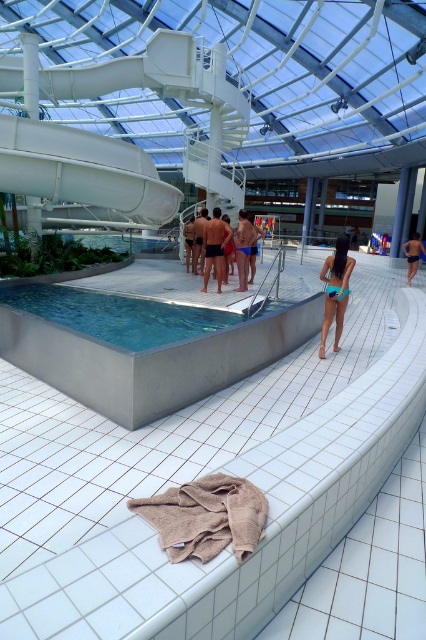
You are a lifeguard observing the pool area. You notice two items at the center of the pool area labeled as dark blue swimsuit at center and smooth blue skin at center. Which item is bigger in size?

The dark blue swimsuit at center is larger in size than the smooth blue skin at center.

You are a lifeguard standing at the edge of the pool. You notice the metallic gray pool at center and the matte black swim trunks at center. Which object is taller?

The matte black swim trunks at center are taller than the metallic gray pool at center.

You are a lifeguard standing at the edge of the pool. You notice the metallic gray pool at center and the matte black swim trunks at center. Which object is bigger in size?

The matte black swim trunks at center are bigger in size compared to the metallic gray pool at center.